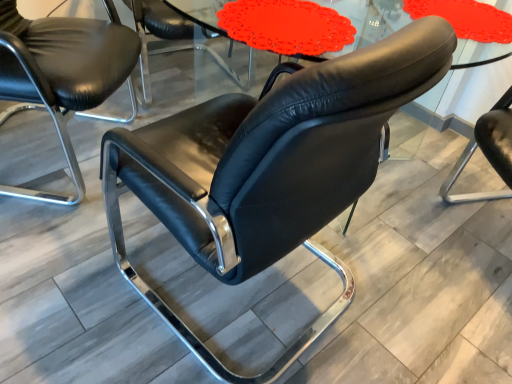
Find the location of a particular element. vacant space situated on the left part of black leather chair at center, the 1th chair viewed from the front is located at coordinates (74, 283).